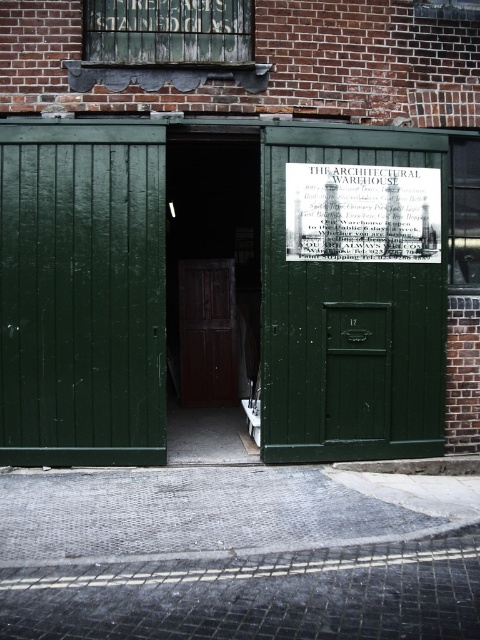
Who is more forward, (x=420, y=198) or (x=207, y=378)?

Positioned in front is point (x=420, y=198).

Between white paper at upper center and wooden door at center, which one is positioned lower?

wooden door at center is lower down.

Image resolution: width=480 pixels, height=640 pixels. Find the location of `white paper at upper center`. white paper at upper center is located at coordinates (361, 212).

This screenshot has width=480, height=640. Find the location of `green wood door at center`. green wood door at center is located at coordinates (83, 292).

Which is behind, point (154, 305) or point (215, 320)?

The point (215, 320) is more distant.

Image resolution: width=480 pixels, height=640 pixels. Find the location of `green wood door at center`. green wood door at center is located at coordinates [x=83, y=292].

Can you confirm if green wood door at center is bigger than white paper at upper center?

Yes, green wood door at center is bigger than white paper at upper center.

Between green wood door at center and white paper at upper center, which one appears on the left side from the viewer's perspective?

From the viewer's perspective, white paper at upper center appears more on the left side.

Who is more distant from viewer, [40,362] or [403,225]?

The point [403,225] is behind.

This screenshot has height=640, width=480. Identify the location of green wood door at center. (83, 292).